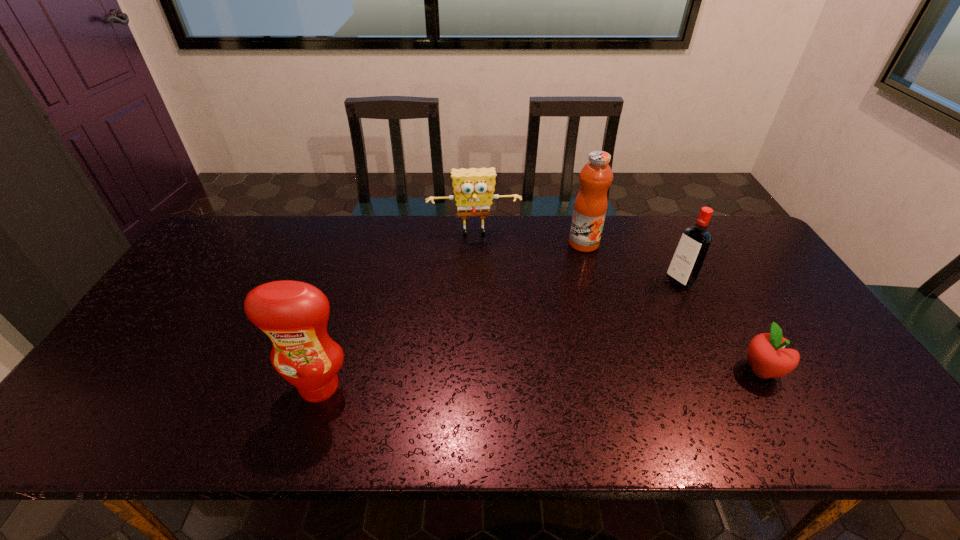
Image resolution: width=960 pixels, height=540 pixels. I want to click on apple at the near edge, so click(766, 354).

What are the coordinates of `vacant space at the far edge` in the screenshot? It's located at (435, 238).

Where is `vacant space at the near edge of the desktop`? vacant space at the near edge of the desktop is located at coordinates (632, 381).

This screenshot has height=540, width=960. Find the location of `vacant region at the left edge of the desktop`. vacant region at the left edge of the desktop is located at coordinates (180, 280).

In the image, there is a desktop. Identify the location of free space at the right edge. (785, 287).

Where is `vacant region at the far left corner of the desktop`? vacant region at the far left corner of the desktop is located at coordinates (241, 258).

Where is `vacant space at the near right corner of the desktop`? vacant space at the near right corner of the desktop is located at coordinates (807, 399).

Locate an element on the screen. empty space that is in between the leftmost object and the sponge is located at coordinates (396, 310).

You are a GUI agent. You are given a task and a screenshot of the screen. Output one action in this format:
    pyautogui.click(x=<x>, y=<y>)
    Task: Click on the empty location between the third object from left to right and the vodka
    
    Given the screenshot: What is the action you would take?
    pyautogui.click(x=632, y=262)

Locate an element on the screen. Image resolution: width=960 pixels, height=540 pixels. vacant point located between the third nearest object and the second object from left to right is located at coordinates (577, 257).